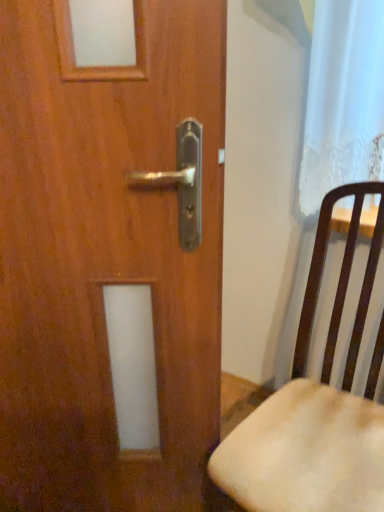
Question: Based on their sizes in the image, would you say wooden door at center is bigger or smaller than wooden chair at right?

Choices:
 (A) big
 (B) small

Answer: (B)

Question: From a real-world perspective, relative to wooden chair at right, is wooden door at center vertically above or below?

Choices:
 (A) above
 (B) below

Answer: (A)

Question: From the image's perspective, relative to wooden chair at right, is wooden door at center above or below?

Choices:
 (A) above
 (B) below

Answer: (A)

Question: Relative to wooden door at center, is wooden chair at right in front or behind?

Choices:
 (A) front
 (B) behind

Answer: (A)

Question: Is point (292, 385) closer or farther from the camera than point (18, 143)?

Choices:
 (A) closer
 (B) farther

Answer: (B)

Question: Is wooden chair at right spatially inside wooden door at center, or outside of it?

Choices:
 (A) inside
 (B) outside

Answer: (B)

Question: From their relative heights in the image, would you say wooden chair at right is taller or shorter than wooden door at center?

Choices:
 (A) short
 (B) tall

Answer: (A)